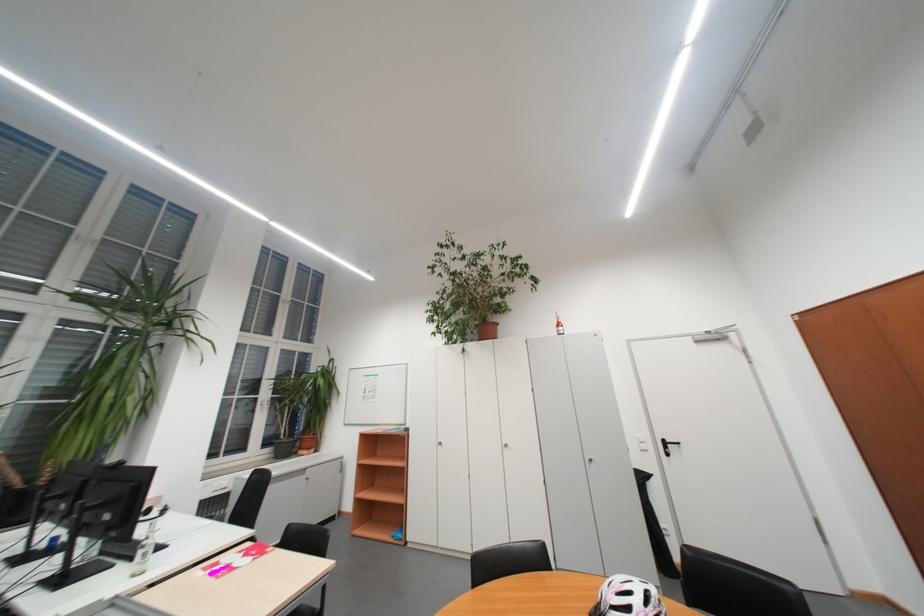
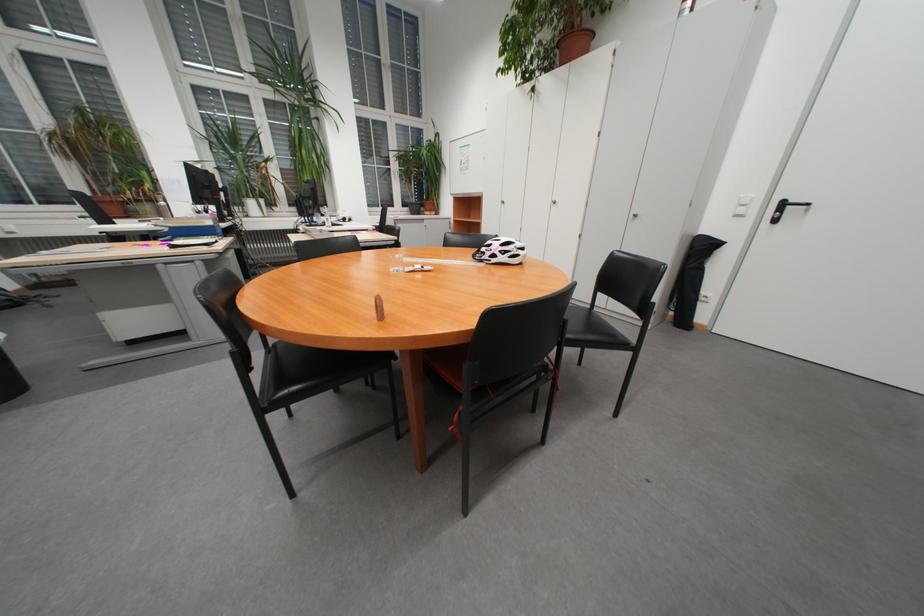
Find the pixel in the second image that matches point (650, 439) in the first image.

(751, 199)